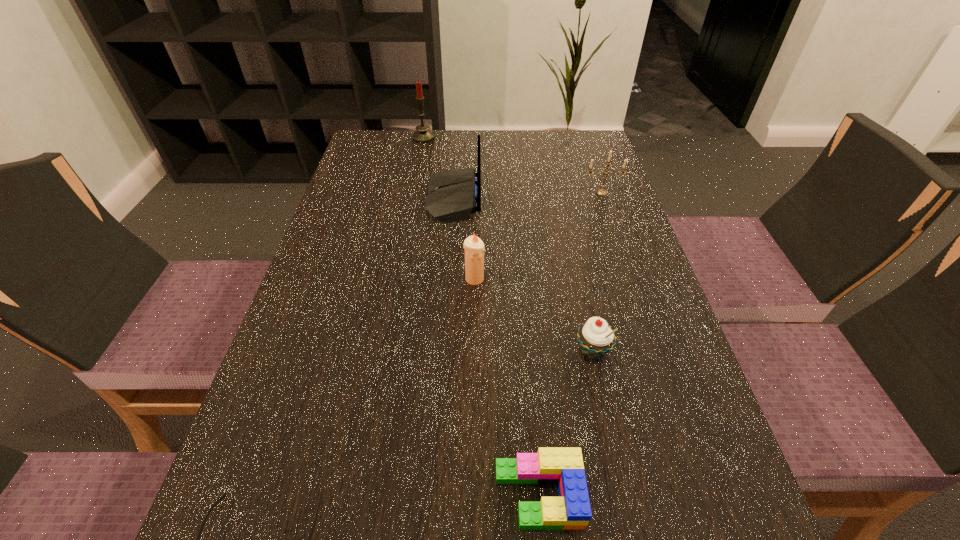
The width and height of the screenshot is (960, 540). I want to click on the leftmost candle, so click(x=422, y=135).

In order to click on the farthest object in this screenshot , I will do `click(422, 135)`.

The width and height of the screenshot is (960, 540). In order to click on router in this screenshot , I will do `click(451, 196)`.

Identify the location of the nearest candle. (474, 247).

Identify the location of the second candle from left to right. The width and height of the screenshot is (960, 540). (474, 247).

What are the coordinates of `the rightmost object` in the screenshot? It's located at (602, 192).

Where is `the second farthest candle`? The image size is (960, 540). the second farthest candle is located at coordinates (602, 192).

Find the location of `the fifth farthest object`. the fifth farthest object is located at coordinates (596, 338).

Find the location of a particular element. This screenshot has width=960, height=540. the second object from right to left is located at coordinates (596, 338).

This screenshot has width=960, height=540. I want to click on the third object from right to left, so click(564, 466).